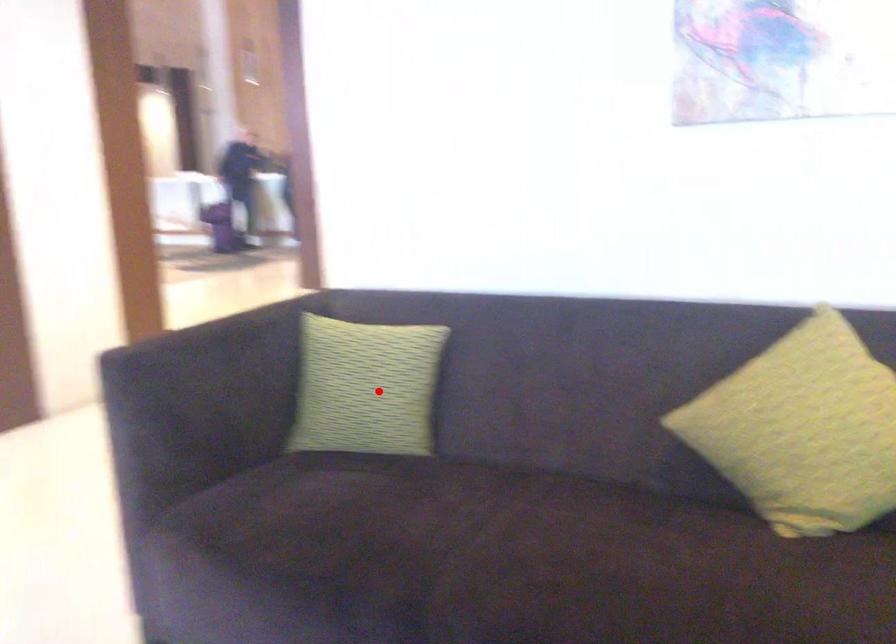
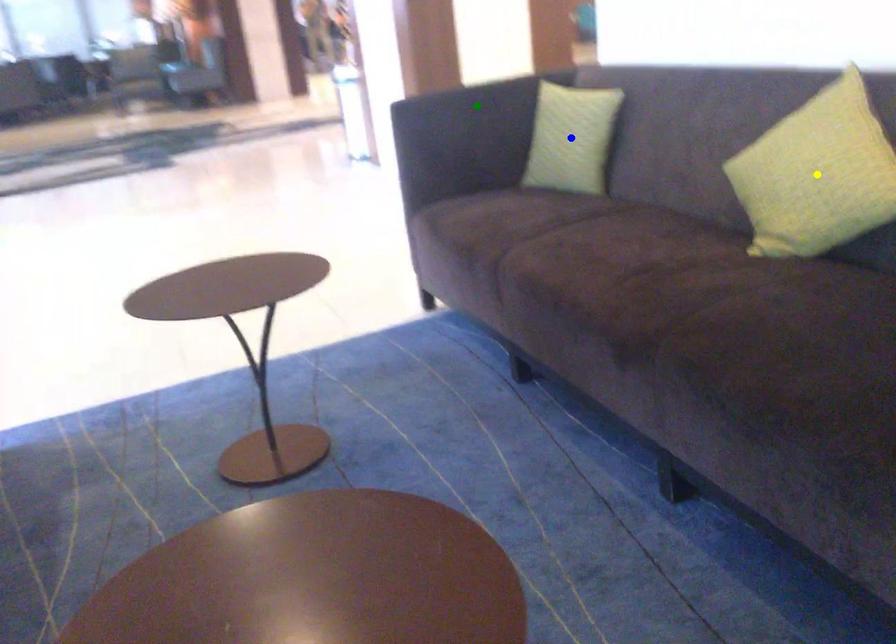
Question: I am providing you with two images of the same scene from different viewpoints. A red point is marked on the first image. You are given multiple points on the second image. Which mark in image 2 goes with the point in image 1?

Choices:
 (A) green point
 (B) yellow point
 (C) blue point

Answer: (C)